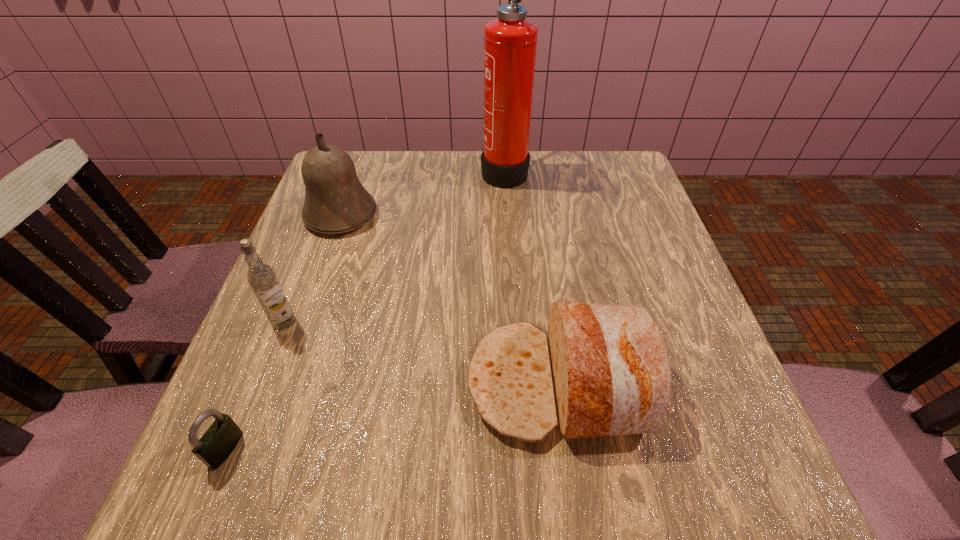
You are a GUI agent. You are given a task and a screenshot of the screen. Output one action in this format:
    pyautogui.click(x=<x>, y=<y>)
    Task: Click on the padlock that is positioned at the left edge
    
    Given the screenshot: What is the action you would take?
    pyautogui.click(x=220, y=439)

Where is `object at the right edge`? object at the right edge is located at coordinates (604, 370).

The height and width of the screenshot is (540, 960). What are the coordinates of `object that is at the far left corner` in the screenshot? It's located at (336, 202).

The width and height of the screenshot is (960, 540). Identify the location of object located at the near left corner. (220, 439).

In order to click on vacant space at the far edge of the desktop in this screenshot , I will do `click(459, 161)`.

Identify the location of vacant space at the left edge of the desktop. (326, 312).

In the image, there is a desktop. Find the location of `blank space at the right edge`. blank space at the right edge is located at coordinates (684, 286).

The width and height of the screenshot is (960, 540). I want to click on vacant space at the far left corner of the desktop, so [x=366, y=182].

Where is `free space at the near left corner of the desktop`? This screenshot has width=960, height=540. free space at the near left corner of the desktop is located at coordinates (260, 466).

This screenshot has height=540, width=960. In order to click on vacant space at the far right corner of the desktop in this screenshot , I will do `click(633, 173)`.